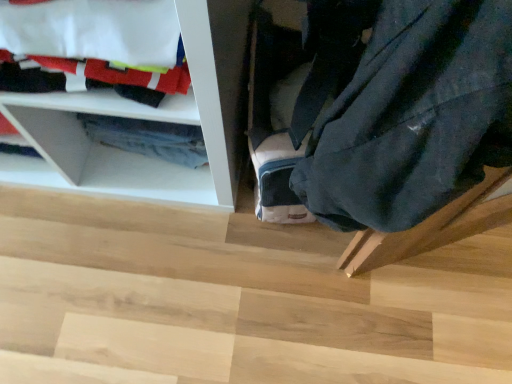
Question: From their relative heights in the image, would you say wooden step at lower right is taller or shorter than white fabric at upper left?

Choices:
 (A) short
 (B) tall

Answer: (A)

Question: From the image's perspective, is wooden step at lower right positioned above or below white fabric at upper left?

Choices:
 (A) below
 (B) above

Answer: (A)

Question: Estimate the real-world distances between objects in this image. Which object is closer to the wooden step at lower right?

Choices:
 (A) dark blue fabric at lower right
 (B) white fabric at upper left

Answer: (B)

Question: Estimate the real-world distances between objects in this image. Which object is farther from the wooden step at lower right?

Choices:
 (A) white fabric at upper left
 (B) dark blue fabric at lower right

Answer: (B)